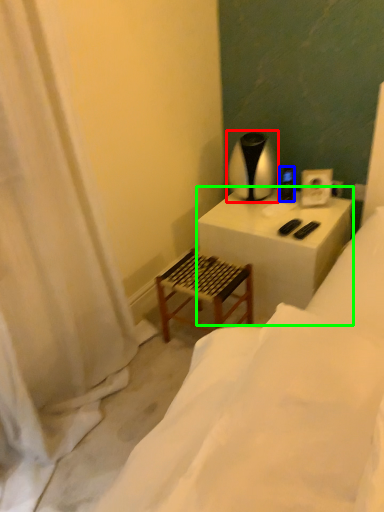
Question: Estimate the real-world distances between objects in this image. Which object is farther from table lamp (highlighted by a red box), appliance (highlighted by a blue box) or table (highlighted by a green box)?

Choices:
 (A) appliance
 (B) table

Answer: (B)